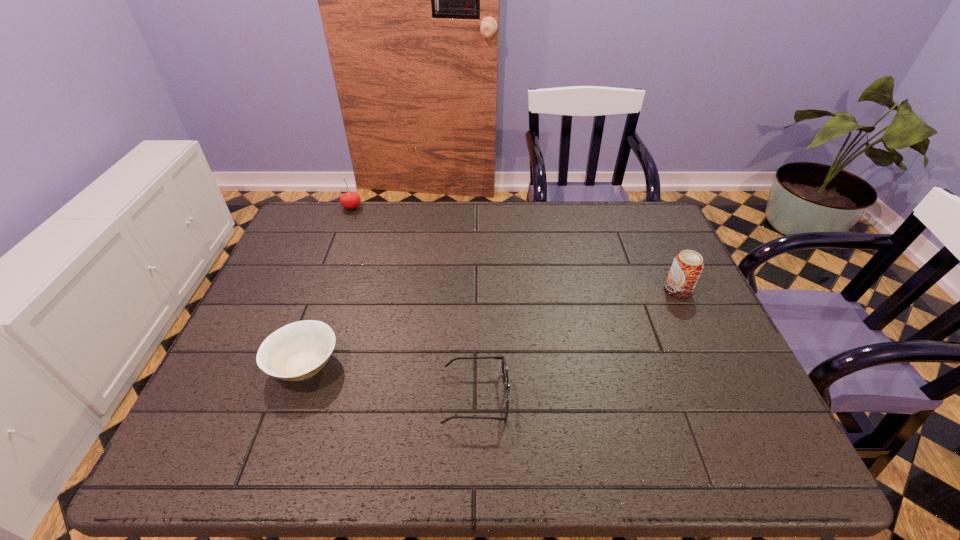
Locate an element on the screen. Image resolution: width=960 pixels, height=540 pixels. object at the far edge is located at coordinates (350, 200).

The width and height of the screenshot is (960, 540). I want to click on object present at the near edge, so click(x=504, y=366).

Where is `cherry situated at the left edge`? The width and height of the screenshot is (960, 540). cherry situated at the left edge is located at coordinates (350, 200).

Find the location of a particular element. This screenshot has width=960, height=540. bowl present at the left edge is located at coordinates (297, 351).

You are a GUI agent. You are given a task and a screenshot of the screen. Output one action in this format:
    pyautogui.click(x=<x>, y=<y>)
    Task: Click on the object at the right edge
    
    Given the screenshot: What is the action you would take?
    pyautogui.click(x=687, y=266)

Locate an element on the screen. This screenshot has height=540, width=960. object that is at the far left corner is located at coordinates (350, 200).

In the image, there is a desktop. Where is `free space at the far edge`? Image resolution: width=960 pixels, height=540 pixels. free space at the far edge is located at coordinates coord(425,225).

Identify the location of free space at the near edge of the desktop. The width and height of the screenshot is (960, 540). (536, 440).

The height and width of the screenshot is (540, 960). In the image, there is a desktop. Find the location of `free space at the left edge`. free space at the left edge is located at coordinates (289, 251).

Locate an element on the screen. The width and height of the screenshot is (960, 540). vacant position at the right edge of the desktop is located at coordinates (650, 279).